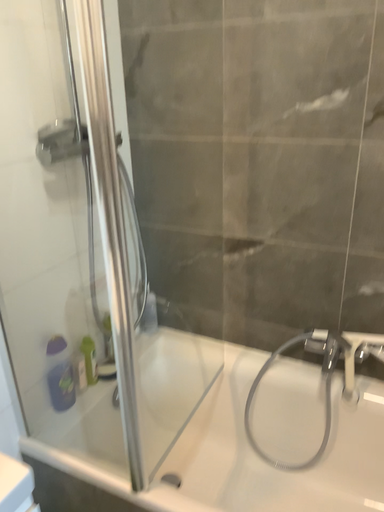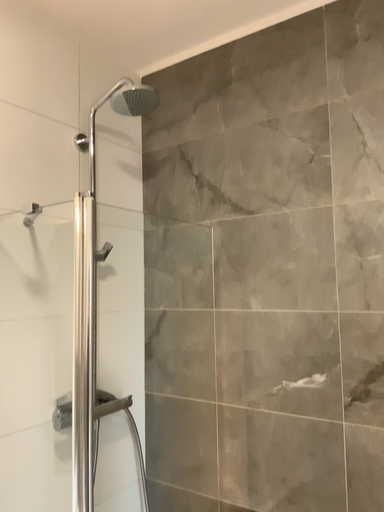
Question: How did the camera likely rotate when shooting the video?

Choices:
 (A) rotated downward
 (B) rotated upward

Answer: (B)